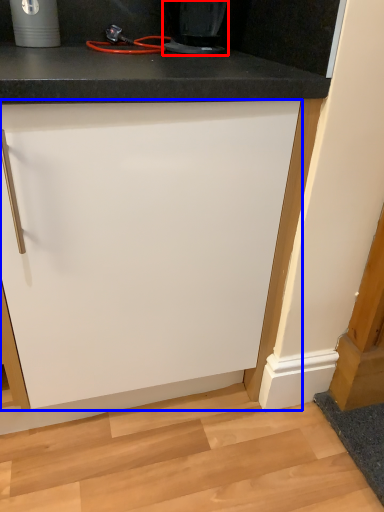
Question: Which object is further to the camera taking this photo, home appliance (highlighted by a red box) or cabinetry (highlighted by a blue box)?

Choices:
 (A) home appliance
 (B) cabinetry

Answer: (A)